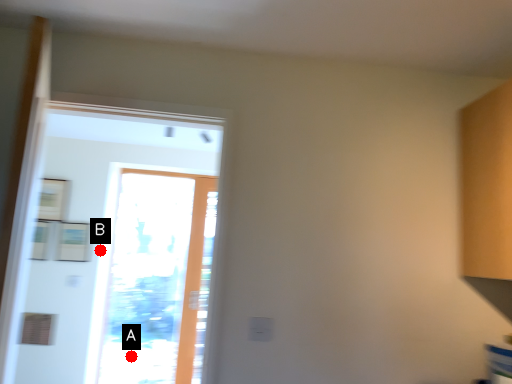
Question: Two points are circled on the image, labeled by A and B beside each circle. Which point is farther to the camera?

Choices:
 (A) A is further
 (B) B is further

Answer: (A)